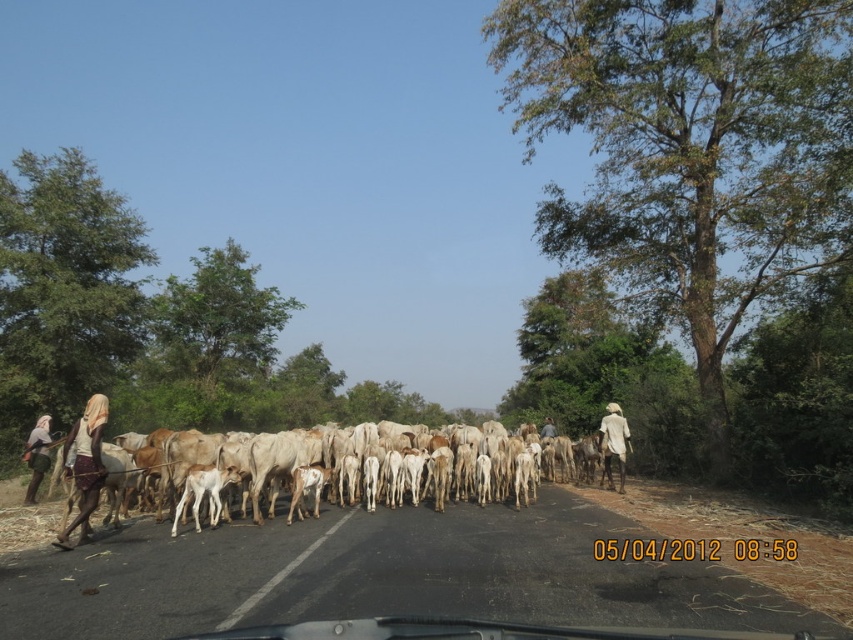
You are standing at the starting point of the road and want to reach the nearest point between the two points, point 1 and point 2, which are marked as point (x=93, y=477) and point (x=27, y=499) respectively. Which point should you head towards to minimize your travel distance?

Point (x=93, y=477) is closer to the camera than point (x=27, y=499), so you should head towards point (x=93, y=477) to minimize your travel distance.

You are a farmer trying to guide the cattle across the road. You notice the white woolly cows at center and the white cloth at left. Which object takes up more horizontal space in the image?

The white cloth at left takes up more horizontal space than the white woolly cows at center because the white woolly cows at center has a lesser width compared to white cloth at left.